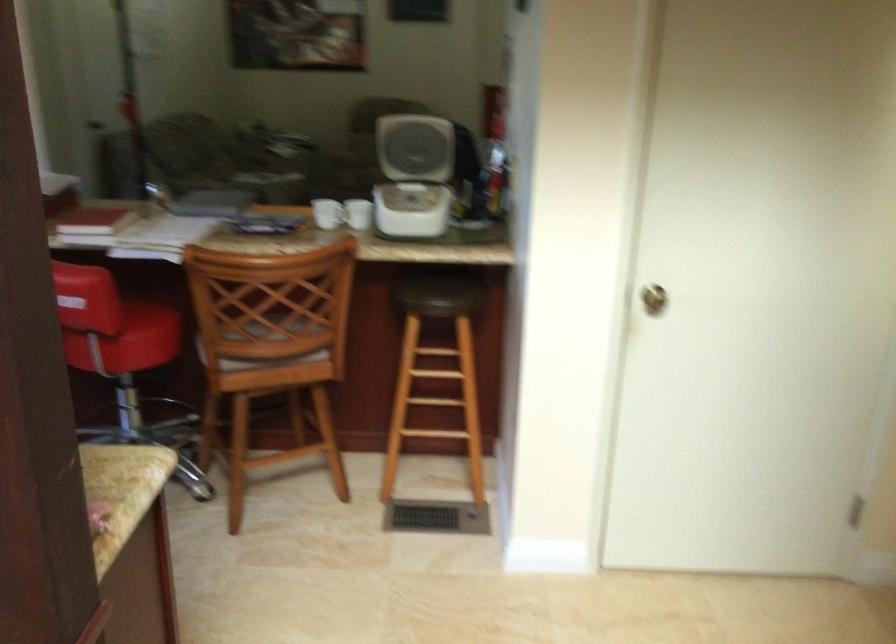
In order to click on stool sitting surface in this screenshot , I will do `click(435, 289)`.